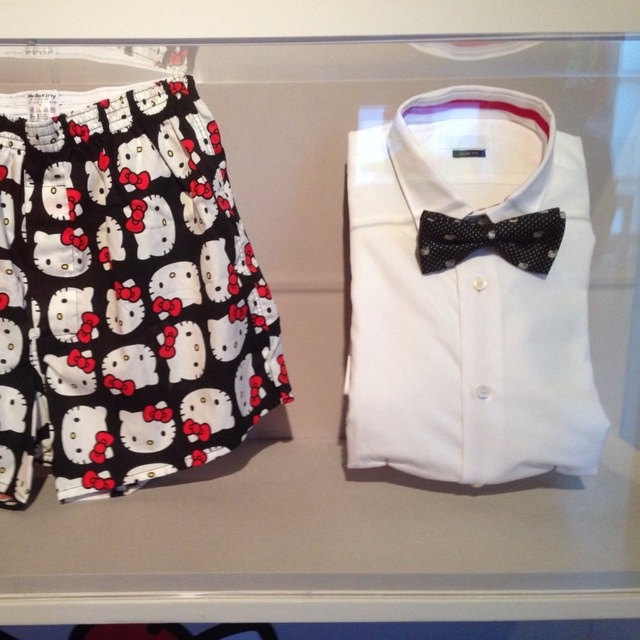
Does point (145, 141) come behind point (465, 253)?

That is False.

Is printed cotton shorts at left smaller than black dotted bow tie at center?

No, printed cotton shorts at left is not smaller than black dotted bow tie at center.

What do you see at coordinates (124, 292) in the screenshot? I see `printed cotton shorts at left` at bounding box center [124, 292].

At what (x,y) coordinates should I click in order to perform the action: click on printed cotton shorts at left. Please return your answer as a coordinate pair (x, y). Image resolution: width=640 pixels, height=640 pixels. Looking at the image, I should click on (124, 292).

Which is in front, point (70, 465) or point (394, 428)?

Positioned in front is point (70, 465).

Who is more distant from viewer, (102, 376) or (493, 376)?

The point (102, 376) is behind.

Where is `printed cotton shorts at left`? Image resolution: width=640 pixels, height=640 pixels. printed cotton shorts at left is located at coordinates (124, 292).

Is white cotton dress shirt at center smaller than black dotted bow tie at center?

Incorrect, white cotton dress shirt at center is not smaller in size than black dotted bow tie at center.

Who is taller, white cotton dress shirt at center or black dotted bow tie at center?

With more height is white cotton dress shirt at center.

Which is behind, point (406, 196) or point (435, 244)?

Point (406, 196)

Identify the location of white cotton dress shirt at center. (470, 292).